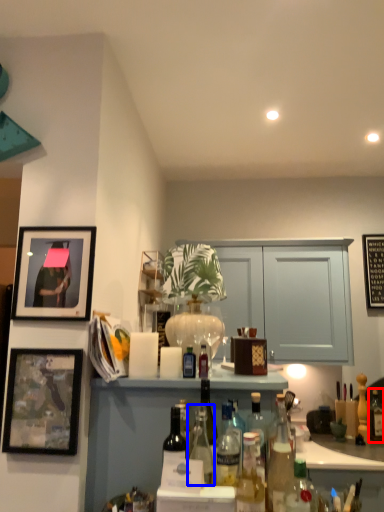
Question: Which object appears closest to the camera in this image, bottle (highlighted by a red box) or bottle (highlighted by a blue box)?

Choices:
 (A) bottle
 (B) bottle

Answer: (B)